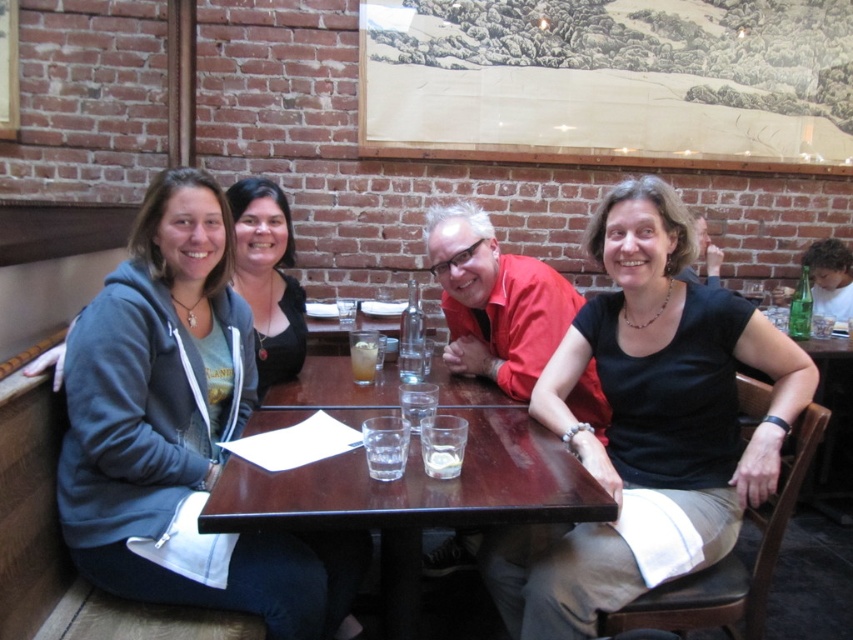
Question: Which is farther from the dark wood table at center?

Choices:
 (A) translucent glass drink at table center
 (B) matte black shirt at center
 (C) black matte shirt at center

Answer: (B)

Question: Considering the relative positions of matte black shirt at center and translucent glass drink at table center in the image provided, where is matte black shirt at center located with respect to translucent glass drink at table center?

Choices:
 (A) right
 (B) left

Answer: (B)

Question: Which object appears farthest from the camera in this image?

Choices:
 (A) translucent glass drink at table center
 (B) black matte shirt at center
 (C) dark wood table at center
 (D) matte gray hoodie at left

Answer: (A)

Question: Can you confirm if black matte shirt at center is positioned above translucent glass drink at table center?

Choices:
 (A) yes
 (B) no

Answer: (B)

Question: Which is farther from the dark wood table at center?

Choices:
 (A) matte gray hoodie at left
 (B) translucent glass drink at table center
 (C) matte black shirt at center

Answer: (C)

Question: Can you confirm if matte black shirt at center is smaller than translucent glass drink at table center?

Choices:
 (A) yes
 (B) no

Answer: (B)